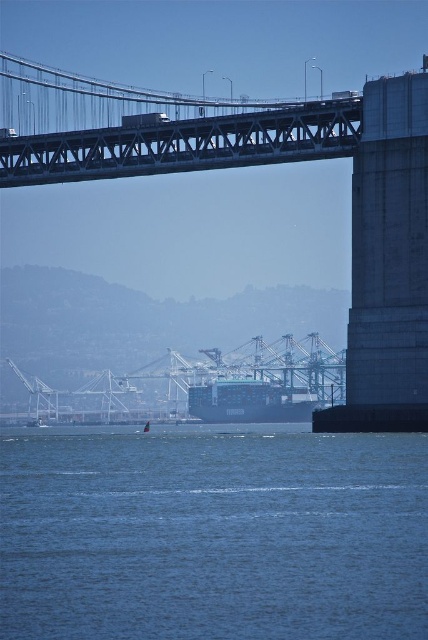
Question: Which point is farther to the camera?

Choices:
 (A) (88, 420)
 (B) (291, 401)
 (C) (261, 547)

Answer: (A)

Question: Does blue water at lower center come behind blue matte cargo ship at center?

Choices:
 (A) yes
 (B) no

Answer: (B)

Question: Does blue water at lower center have a lesser width compared to metallic gray bridge at center?

Choices:
 (A) no
 (B) yes

Answer: (B)

Question: Which object is the farthest from the blue water at lower center?

Choices:
 (A) metallic gray bridge at center
 (B) blue matte cargo ship at center

Answer: (A)

Question: Where is blue water at lower center located in relation to blue matte cargo ship at center in the image?

Choices:
 (A) right
 (B) left

Answer: (B)

Question: Which of the following is the farthest from the observer?

Choices:
 (A) metallic gray bridge at center
 (B) blue water at lower center
 (C) blue matte cargo ship at center

Answer: (C)